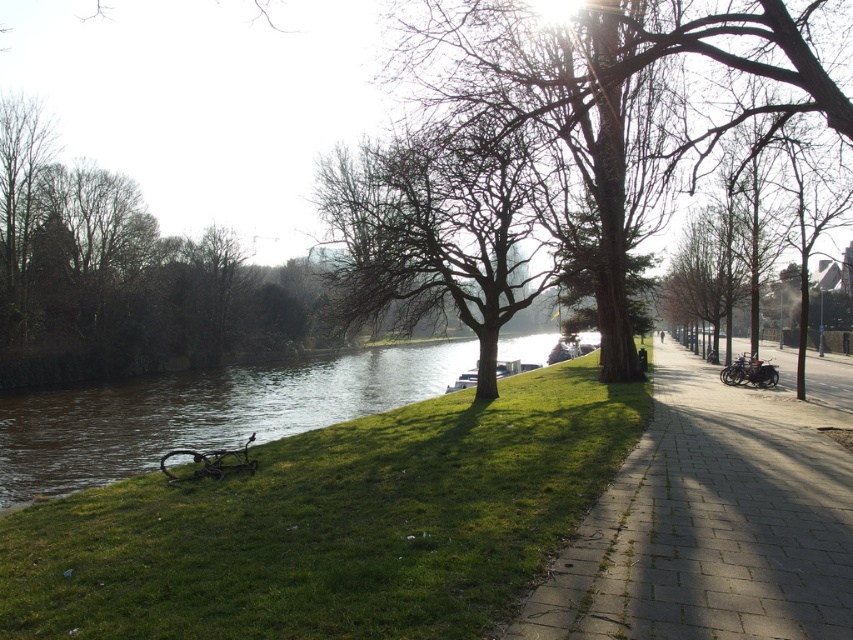
You are planning to place a small garden bench in the scene. Given the sizes of the green grass at lower left and the paved stone sidewalk at center, which location would provide enough space for the bench?

The paved stone sidewalk at center has a larger size than the green grass at lower left, so the bench would fit better there.

You are a hiker who wants to take a photo of both the smooth bark tree at center and the bare wood tree at center. Which tree should you stand closer to in order to capture both in a single frame without moving the camera?

You should stand closer to the bare wood tree at center because it is shorter than the smooth bark tree at center, allowing both to fit within the camera frame when positioned appropriately.